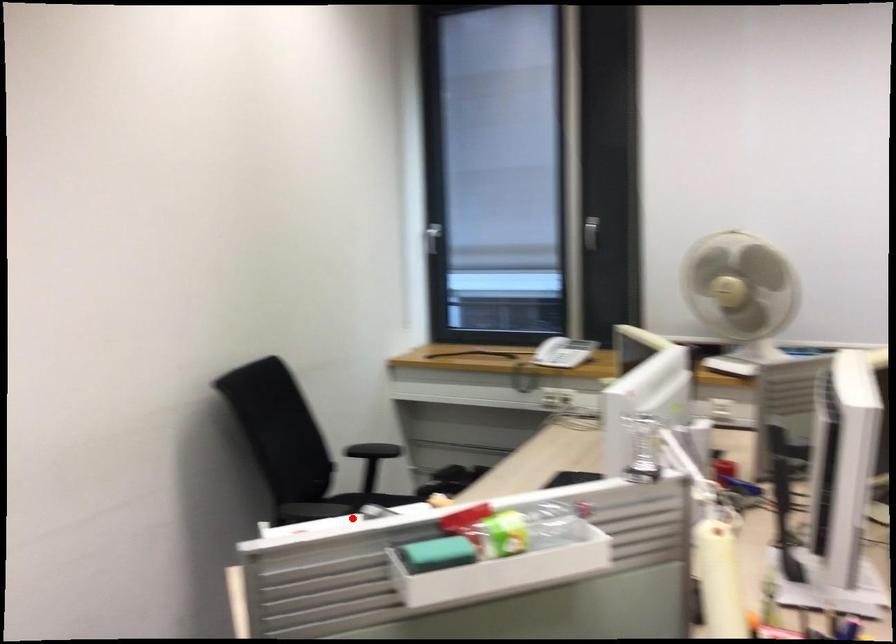
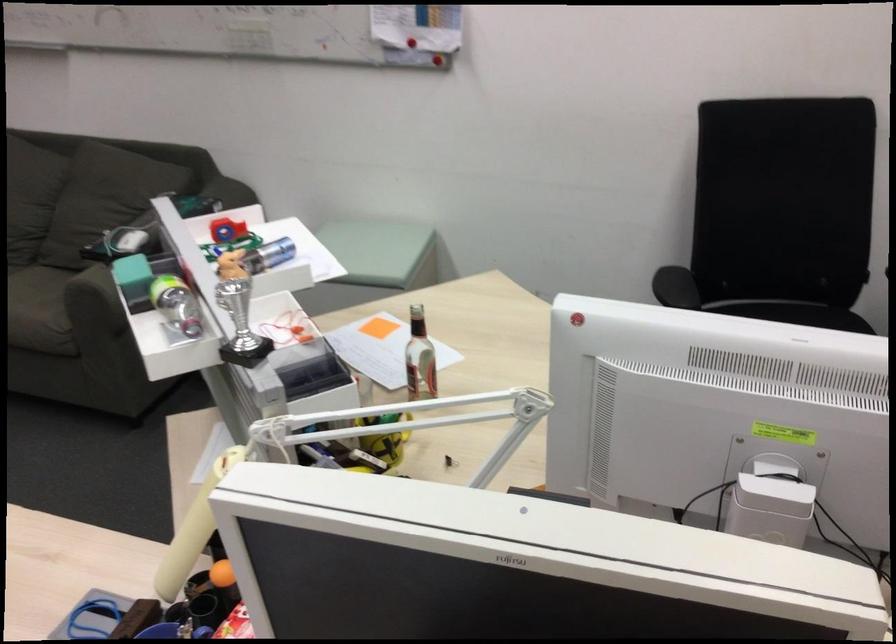
The point at the highlighted location is marked in the first image. Where is the corresponding point in the second image?

(274, 252)